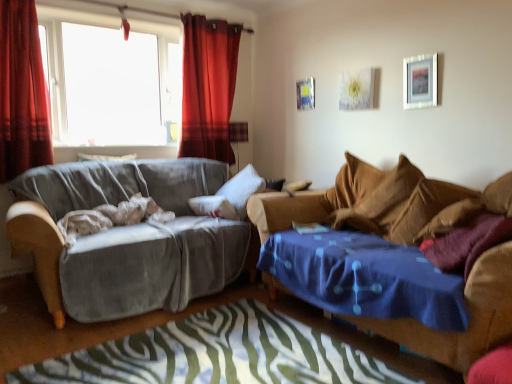
Question: From the image's perspective, is velvet red curtain at upper left, which appears as the 1th curtain when viewed from the back, under metallic silver picture frame at upper center, the 1th picture frame in the back-to-front sequence?

Choices:
 (A) no
 (B) yes

Answer: (A)

Question: Is velvet red curtain at upper left, the 2th curtain from the left, oriented towards metallic silver picture frame at upper center, which is the 2th picture frame in right-to-left order?

Choices:
 (A) no
 (B) yes

Answer: (A)

Question: Is velvet red curtain at upper left, the 2th curtain from the left, oriented away from metallic silver picture frame at upper center, which is the 2th picture frame in right-to-left order?

Choices:
 (A) no
 (B) yes

Answer: (A)

Question: Can you confirm if velvet red curtain at upper left, the 1th curtain when ordered from right to left, is taller than metallic silver picture frame at upper center, which is the second picture frame in front-to-back order?

Choices:
 (A) yes
 (B) no

Answer: (A)

Question: Does velvet red curtain at upper left, which ranks as the second curtain in front-to-back order, have a lesser height compared to metallic silver picture frame at upper center, which is the 2th picture frame in right-to-left order?

Choices:
 (A) no
 (B) yes

Answer: (A)

Question: Does point (401, 213) appear closer or farther from the camera than point (415, 56)?

Choices:
 (A) farther
 (B) closer

Answer: (B)

Question: From the image's perspective, is brown fabric pillow at right above or below silver metallic picture frame at upper right, the first picture frame from the front?

Choices:
 (A) above
 (B) below

Answer: (B)

Question: Considering the positions of brown fabric pillow at right and silver metallic picture frame at upper right, placed as the second picture frame when sorted from left to right, in the image, is brown fabric pillow at right bigger or smaller than silver metallic picture frame at upper right, placed as the second picture frame when sorted from left to right,?

Choices:
 (A) big
 (B) small

Answer: (A)

Question: Would you say brown fabric pillow at right is inside or outside silver metallic picture frame at upper right, placed as the second picture frame when sorted from left to right?

Choices:
 (A) inside
 (B) outside

Answer: (B)

Question: In terms of width, does velvet red curtain at upper left, which ranks as the second curtain in front-to-back order, look wider or thinner when compared to blue fabric bedcover at lower center?

Choices:
 (A) thin
 (B) wide

Answer: (A)

Question: From the image's perspective, is velvet red curtain at upper left, which appears as the 1th curtain when viewed from the back, above or below blue fabric bedcover at lower center?

Choices:
 (A) above
 (B) below

Answer: (A)

Question: Is point (225, 109) closer or farther from the camera than point (195, 334)?

Choices:
 (A) closer
 (B) farther

Answer: (B)

Question: From a real-world perspective, is velvet red curtain at upper left, which appears as the 1th curtain when viewed from the back, positioned above or below blue fabric bedcover at lower center?

Choices:
 (A) below
 (B) above

Answer: (B)

Question: Is point (303, 107) closer or farther from the camera than point (48, 206)?

Choices:
 (A) farther
 (B) closer

Answer: (A)

Question: From the image's perspective, is metallic silver picture frame at upper center, the 1th picture frame in the back-to-front sequence, located above or below velvet gray couch at left, marked as the 1th studio couch in a left-to-right arrangement?

Choices:
 (A) above
 (B) below

Answer: (A)